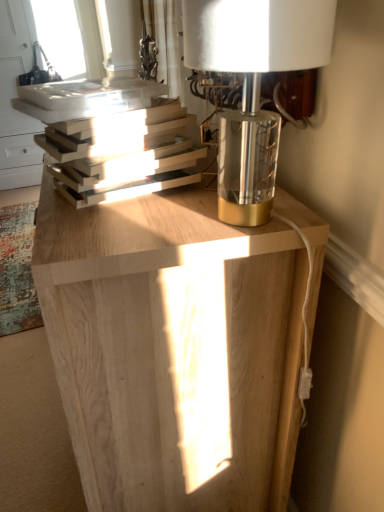
Question: Can you confirm if hardcover books at left is shorter than metallic gold base at upper right?

Choices:
 (A) yes
 (B) no

Answer: (A)

Question: Is hardcover books at left closer to the viewer compared to metallic gold base at upper right?

Choices:
 (A) yes
 (B) no

Answer: (B)

Question: Is hardcover books at left not close to metallic gold base at upper right?

Choices:
 (A) yes
 (B) no

Answer: (B)

Question: Is the surface of hardcover books at left in direct contact with metallic gold base at upper right?

Choices:
 (A) no
 (B) yes

Answer: (A)

Question: Is hardcover books at left positioned beyond the bounds of metallic gold base at upper right?

Choices:
 (A) yes
 (B) no

Answer: (A)

Question: Can you confirm if hardcover books at left is smaller than metallic gold base at upper right?

Choices:
 (A) no
 (B) yes

Answer: (B)

Question: Is the position of natural wood table at center more distant than that of clear glass window at upper left?

Choices:
 (A) no
 (B) yes

Answer: (A)

Question: Are natural wood table at center and clear glass window at upper left located far from each other?

Choices:
 (A) yes
 (B) no

Answer: (A)

Question: Does natural wood table at center have a lesser width compared to clear glass window at upper left?

Choices:
 (A) no
 (B) yes

Answer: (B)

Question: Does natural wood table at center turn towards clear glass window at upper left?

Choices:
 (A) no
 (B) yes

Answer: (A)

Question: From the image's perspective, is natural wood table at center below clear glass window at upper left?

Choices:
 (A) yes
 (B) no

Answer: (A)

Question: Is natural wood table at center outside clear glass window at upper left?

Choices:
 (A) yes
 (B) no

Answer: (A)

Question: From the image's perspective, is hardcover books at left on top of clear glass window at upper left?

Choices:
 (A) yes
 (B) no

Answer: (B)